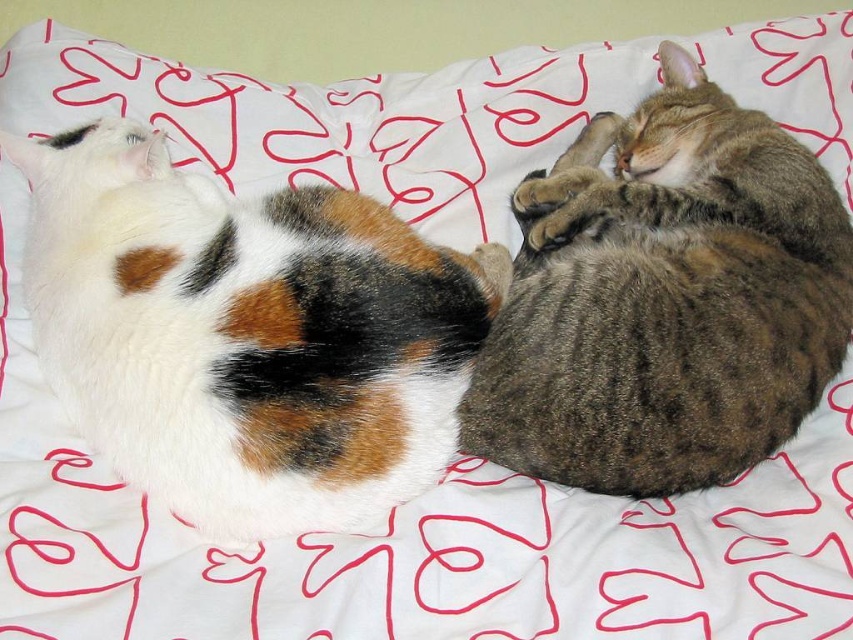
Can you confirm if white fluffy cat at left is positioned above tabby fur cat at center?

Actually, white fluffy cat at left is below tabby fur cat at center.

Who is positioned more to the left, white fluffy cat at left or tabby fur cat at center?

Positioned to the left is white fluffy cat at left.

This screenshot has height=640, width=853. Describe the element at coordinates (247, 333) in the screenshot. I see `white fluffy cat at left` at that location.

In order to click on white fluffy cat at left in this screenshot , I will do `click(247, 333)`.